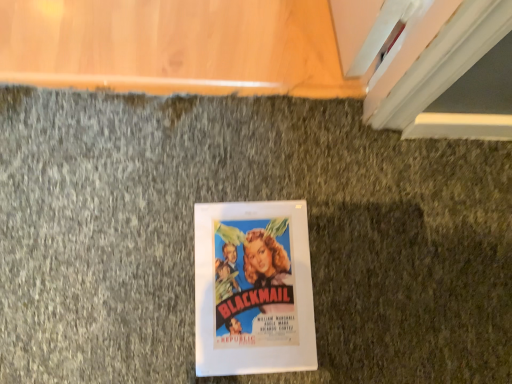
What is the approximate height of matte paper poster at center?

matte paper poster at center is 0.66 inches in height.

Describe the element at coordinates (253, 289) in the screenshot. I see `matte paper poster at center` at that location.

At what (x,y) coordinates should I click in order to perform the action: click on matte paper poster at center. Please return your answer as a coordinate pair (x, y). The image size is (512, 384). Looking at the image, I should click on (253, 289).

The height and width of the screenshot is (384, 512). I want to click on matte paper poster at center, so click(x=253, y=289).